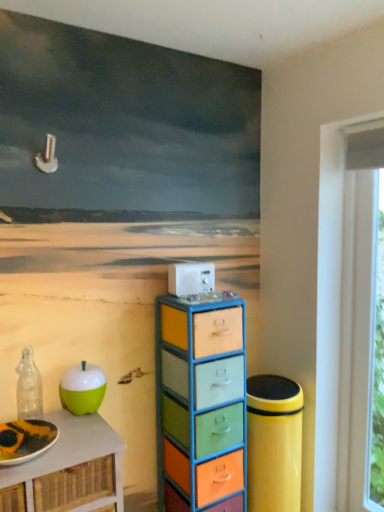
The width and height of the screenshot is (384, 512). In order to click on vacant space underneath matte white plate at lower left (from a real-world perspective) in this screenshot , I will do `click(25, 456)`.